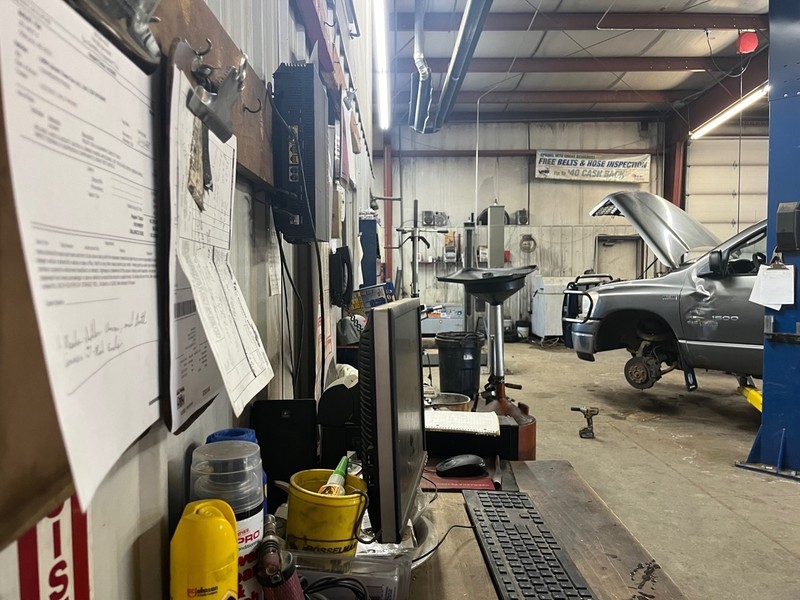
I want to click on beige surface, so click(x=717, y=507).